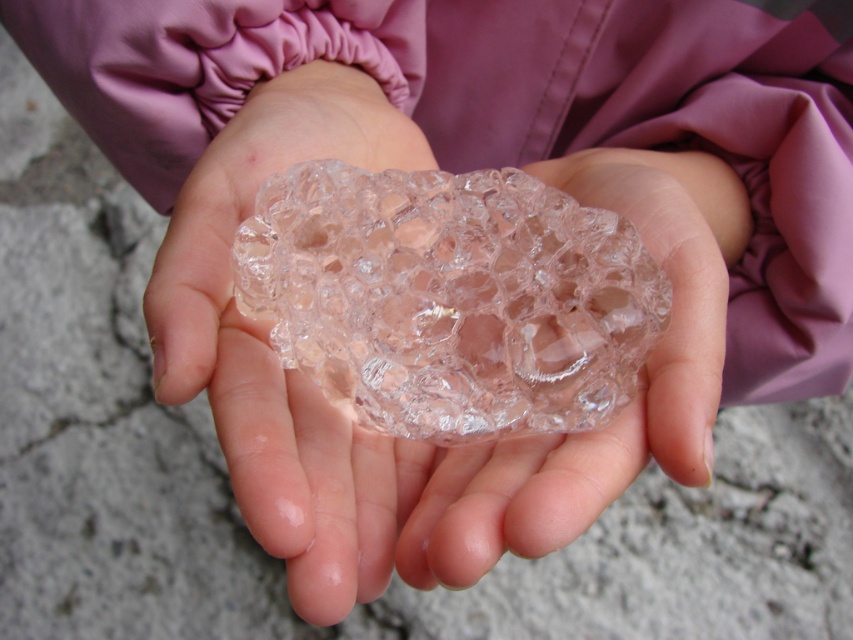
Question: In this image, where is transparent plastic rock at center located relative to transparent glass crystal at center?

Choices:
 (A) below
 (B) above

Answer: (B)

Question: Is transparent plastic rock at center closer to the viewer compared to transparent glass crystal at center?

Choices:
 (A) yes
 (B) no

Answer: (A)

Question: Which object appears closest to the camera in this image?

Choices:
 (A) transparent plastic rock at center
 (B) transparent glass crystal at center

Answer: (A)

Question: Is transparent plastic rock at center wider than transparent glass crystal at center?

Choices:
 (A) no
 (B) yes

Answer: (B)

Question: Which of the following is the closest to the observer?

Choices:
 (A) (408, 417)
 (B) (265, 392)

Answer: (A)